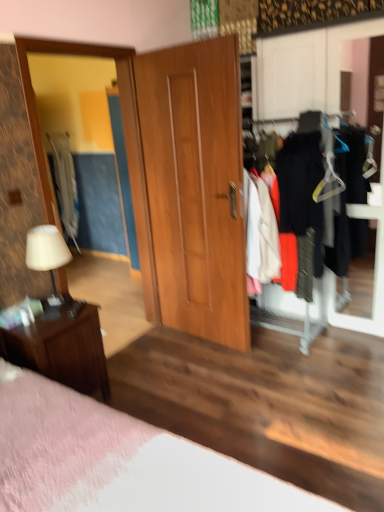
The image size is (384, 512). What do you see at coordinates (65, 185) in the screenshot?
I see `light gray fabric coat at left` at bounding box center [65, 185].

The height and width of the screenshot is (512, 384). Identify the location of brown wood nightstand at lower left. (62, 348).

This screenshot has height=512, width=384. Describe the element at coordinates (117, 460) in the screenshot. I see `pink fabric bed at lower left` at that location.

What do you see at coordinates (125, 145) in the screenshot? I see `matte wooden mirror at left` at bounding box center [125, 145].

Identify the location of wooden door at center. (196, 186).

Where is `yellow plastic hanger at center right`? yellow plastic hanger at center right is located at coordinates (328, 182).

In order to face matte black clothes at right, should I rotate leftwards or rightwards?

To face it directly, rotate right by 18.283 degrees.

Identify the location of light gray fabric coat at left. Image resolution: width=384 pixels, height=512 pixels. (65, 185).

Between brown wood nightstand at lower left and matte wooden mirror at left, which one has more height?

Standing taller between the two is matte wooden mirror at left.

Is brown wood nightstand at lower left aimed at matte wooden mirror at left?

No, brown wood nightstand at lower left is not facing towards matte wooden mirror at left.

Is brown wood nightstand at lower left inside or outside of matte wooden mirror at left?

The correct answer is: outside.

In the image, is brown wood nightstand at lower left positioned in front of or behind matte wooden mirror at left?

brown wood nightstand at lower left is positioned closer to the viewer than matte wooden mirror at left.

Is point (35, 367) less distant than point (324, 191)?

Yes, point (35, 367) is closer to viewer.

Would you say brown wood nightstand at lower left is a long distance from yellow plastic hanger at center right?

Yes.

Is brown wood nightstand at lower left to the left of yellow plastic hanger at center right from the viewer's perspective?

Yes, brown wood nightstand at lower left is to the left of yellow plastic hanger at center right.

Does brown wood nightstand at lower left have a greater height compared to yellow plastic hanger at center right?

Indeed, brown wood nightstand at lower left has a greater height compared to yellow plastic hanger at center right.

Considering the sizes of objects yellow plastic hanger at center right and pink fabric bed at lower left in the image provided, who is smaller, yellow plastic hanger at center right or pink fabric bed at lower left?

Smaller between the two is yellow plastic hanger at center right.

Considering the positions of objects yellow plastic hanger at center right and pink fabric bed at lower left in the image provided, who is more to the right, yellow plastic hanger at center right or pink fabric bed at lower left?

yellow plastic hanger at center right is more to the right.

Is point (88, 45) positioned after point (176, 490)?

Yes, it is.

Considering the positions of objects matte wooden mirror at left and pink fabric bed at lower left in the image provided, who is more to the left, matte wooden mirror at left or pink fabric bed at lower left?

matte wooden mirror at left is more to the left.

Which object is more forward, yellow plastic hanger at center right or brown wood nightstand at lower left?

brown wood nightstand at lower left is more forward.

How different are the orientations of yellow plastic hanger at center right and brown wood nightstand at lower left in degrees?

yellow plastic hanger at center right and brown wood nightstand at lower left are facing 92.7 degrees away from each other.

Which is less distant, [323,194] or [42,352]?

Point [323,194] is positioned farther from the camera compared to point [42,352].

From a real-world perspective, between yellow plastic hanger at center right and brown wood nightstand at lower left, who is vertically lower?

brown wood nightstand at lower left.

Looking at this image, considering the positions of objects matte wooden mirror at left and brown wood nightstand at lower left in the image provided, who is more to the right, matte wooden mirror at left or brown wood nightstand at lower left?

matte wooden mirror at left is more to the right.

Who is smaller, matte wooden mirror at left or brown wood nightstand at lower left?

With smaller size is brown wood nightstand at lower left.

Would you consider matte wooden mirror at left to be distant from brown wood nightstand at lower left?

Actually, matte wooden mirror at left and brown wood nightstand at lower left are a little close together.

Consider the image. Relative to matte wooden mirror at left, is matte black clothes at right in front or behind?

matte black clothes at right is positioned farther from the viewer than matte wooden mirror at left.

Locate an element on the screen. Image resolution: width=384 pixels, height=512 pixels. mirror beneath the matte black clothes at right (from a real-world perspective) is located at coordinates pos(125,145).

From the image's perspective, which is below, matte black clothes at right or matte wooden mirror at left?

matte wooden mirror at left, from the image's perspective.

The width and height of the screenshot is (384, 512). Identify the location of mirror above the brown wood nightstand at lower left (from a real-world perspective). (125, 145).

You are a GUI agent. You are given a task and a screenshot of the screen. Output one action in this format:
    pyautogui.click(x=<x>, y=<y>)
    Task: Click on the hanger located on the right of brown wood nightstand at lower left
    This screenshot has width=384, height=512.
    Given the screenshot: What is the action you would take?
    pyautogui.click(x=328, y=182)

Estimate the real-world distances between objects in this image. Which object is further from matte white lamp at left, wooden door at center or pink fabric bed at lower left?

wooden door at center is further to matte white lamp at left.

Which object lies nearer to the anchor point wooden door at center, light gray fabric coat at left or matte wooden mirror at left?

The object closer to wooden door at center is matte wooden mirror at left.

Looking at the image, which one is located closer to brown wood nightstand at lower left, matte black clothes at right or pink fabric bed at lower left?

pink fabric bed at lower left is closer to brown wood nightstand at lower left.

Estimate the real-world distances between objects in this image. Which object is closer to matte white lamp at left, light gray fabric coat at left or matte black clothes at right?

matte black clothes at right is closer to matte white lamp at left.

Looking at the image, which one is located closer to light gray fabric coat at left, yellow plastic hanger at center right or matte black clothes at right?

matte black clothes at right is closer to light gray fabric coat at left.

Considering their positions, is matte wooden mirror at left positioned further to matte white lamp at left than wooden door at center?

wooden door at center.

Based on their spatial positions, is matte wooden mirror at left or pink fabric bed at lower left closer to light gray fabric coat at left?

matte wooden mirror at left.

When comparing their distances from wooden door at center, does light gray fabric coat at left or matte white lamp at left seem further?

Based on the image, light gray fabric coat at left appears to be further to wooden door at center.

This screenshot has width=384, height=512. Find the location of `nightstand located between pink fabric bed at lower left and light gray fabric coat at left in the depth direction`. nightstand located between pink fabric bed at lower left and light gray fabric coat at left in the depth direction is located at coordinates (62, 348).

This screenshot has height=512, width=384. I want to click on closet positioned between yellow plastic hanger at center right and light gray fabric coat at left from near to far, so click(x=322, y=189).

Identify the location of mirror situated between matte white lamp at left and yellow plastic hanger at center right from left to right. (125, 145).

Find the location of `closet between pink fabric bed at lower left and light gray fabric coat at left from front to back`. closet between pink fabric bed at lower left and light gray fabric coat at left from front to back is located at coordinates (322, 189).